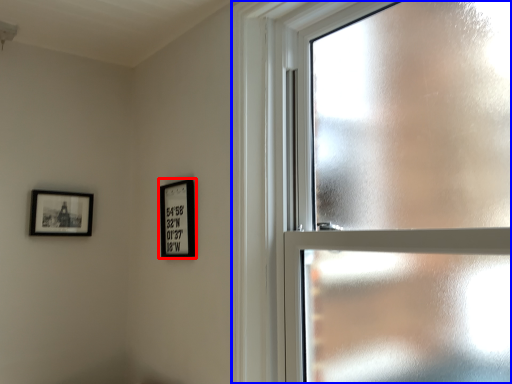
Question: Among these objects, which one is farthest to the camera, picture frame (highlighted by a red box) or window (highlighted by a blue box)?

Choices:
 (A) picture frame
 (B) window

Answer: (A)